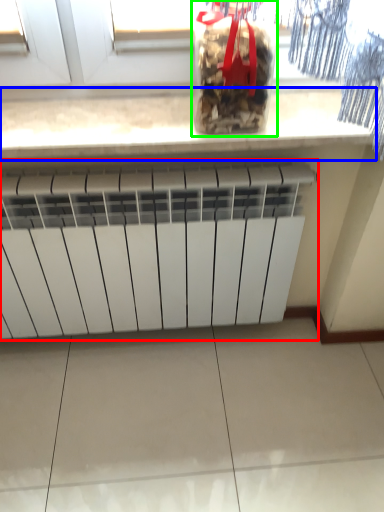
Question: Which object is positioned closest to radiator (highlighted by a red box)? Select from countertop (highlighted by a blue box) and wine bottle (highlighted by a green box).

Choices:
 (A) countertop
 (B) wine bottle

Answer: (A)